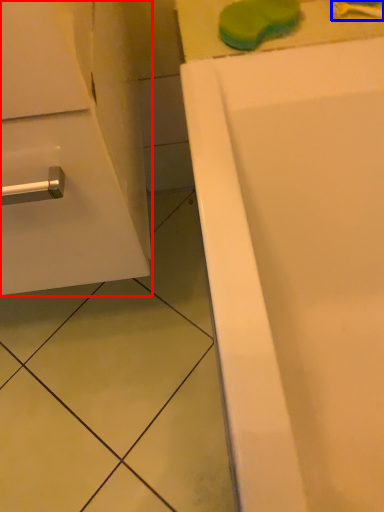
Question: Which object appears closest to the camera in this image, bathroom cabinet (highlighted by a red box) or toothbrush (highlighted by a blue box)?

Choices:
 (A) bathroom cabinet
 (B) toothbrush

Answer: (A)